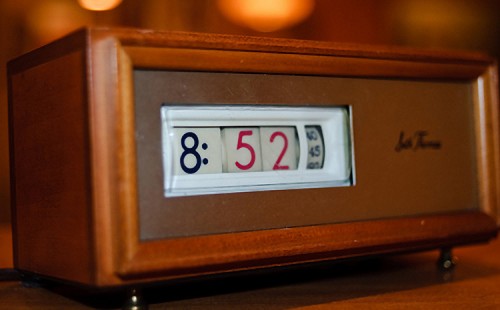
At what (x,y) coordinates should I click in order to perform the action: click on metallic legs (front). Please return your answer as a coordinate pair (x, y). This screenshot has width=500, height=310. Looking at the image, I should click on (132, 301), (448, 260).